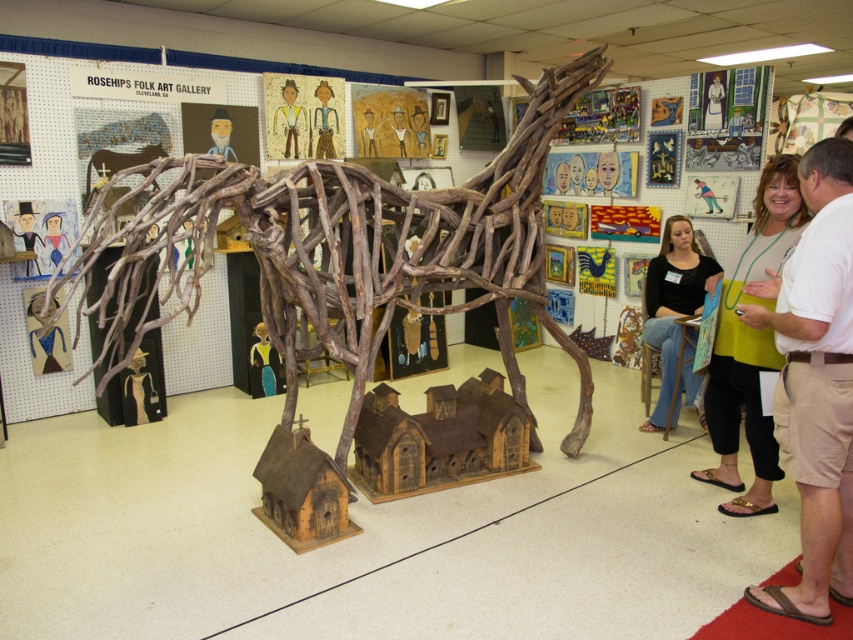
Is brown driftwood horse at center further to camera compared to matte black shirt at center?

No, brown driftwood horse at center is closer to the viewer.

I want to click on brown driftwood horse at center, so click(351, 246).

Who is more forward, (202, 211) or (698, 296)?

Point (202, 211) is more forward.

What are the coordinates of `brown driftwood horse at center` in the screenshot? It's located at (351, 246).

Between point (735, 486) and point (665, 268), which one is positioned in front?

Point (735, 486) is more forward.

Which is more to the left, green fabric dress at right or matte black shirt at center?

Positioned to the left is green fabric dress at right.

Does point (730, 500) come farther from viewer compared to point (645, 337)?

No, (730, 500) is closer to viewer.

At what (x,y) coordinates should I click in order to perform the action: click on green fabric dress at right. Please return your answer as a coordinate pair (x, y). The image size is (853, 640). Looking at the image, I should click on (737, 429).

Between point (285, 257) and point (714, 349), which one is positioned behind?

The point (714, 349) is behind.

Is point (289, 401) more distant than point (730, 273)?

Yes, it is.

Describe the element at coordinates (351, 246) in the screenshot. I see `brown driftwood horse at center` at that location.

Where is `brown driftwood horse at center`? brown driftwood horse at center is located at coordinates (351, 246).